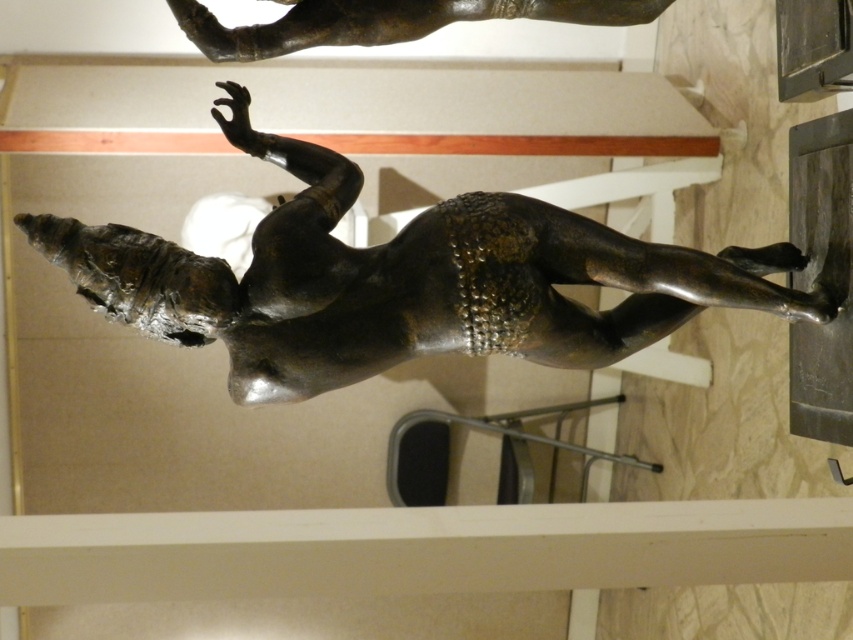
Question: Which object appears closest to the camera in this image?

Choices:
 (A) shiny bronze statue at upper center
 (B) bronze statue at center

Answer: (B)

Question: Can you confirm if bronze statue at center is positioned to the right of shiny bronze statue at upper center?

Choices:
 (A) no
 (B) yes

Answer: (B)

Question: Is bronze statue at center wider than shiny bronze statue at upper center?

Choices:
 (A) no
 (B) yes

Answer: (B)

Question: Does bronze statue at center have a larger size compared to shiny bronze statue at upper center?

Choices:
 (A) no
 (B) yes

Answer: (B)